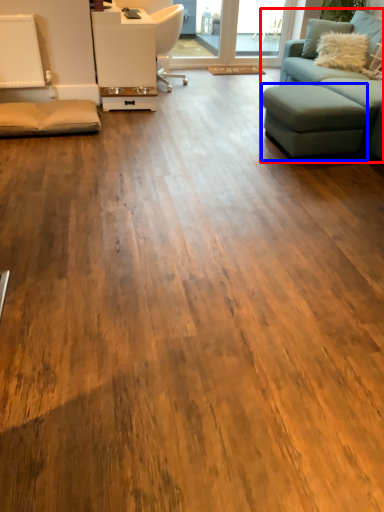
Question: Which of the following is the farthest to the observer, studio couch (highlighted by a red box) or footrest (highlighted by a blue box)?

Choices:
 (A) studio couch
 (B) footrest

Answer: (B)